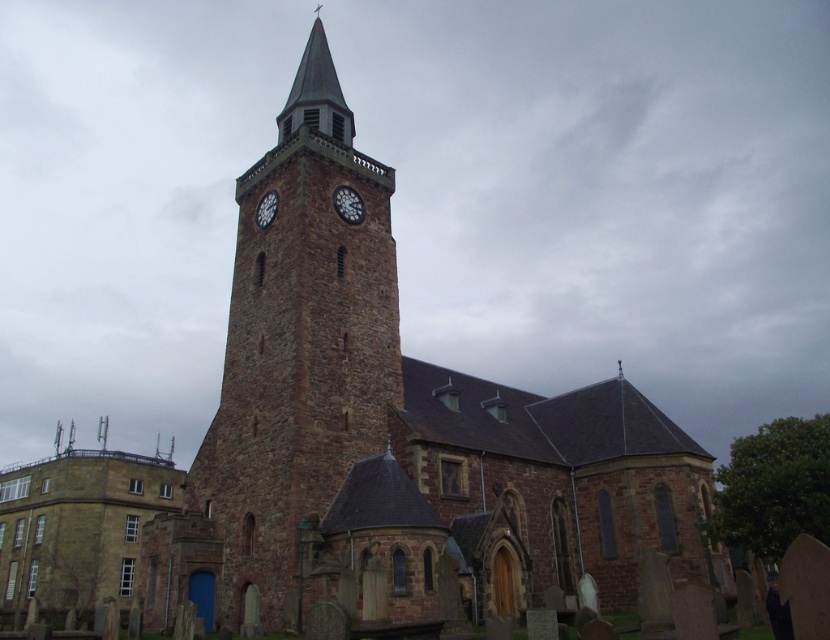
Can you confirm if dark brown wooden clock at center is wider than matte brown clock at upper center?

Correct, the width of dark brown wooden clock at center exceeds that of matte brown clock at upper center.

Between point (360, 220) and point (269, 205), which one is positioned in front?

Point (269, 205) is more forward.

The width and height of the screenshot is (830, 640). Identify the location of dark brown wooden clock at center. (348, 204).

How distant is brown stone clock tower at center from dark brown wooden clock at center?

brown stone clock tower at center and dark brown wooden clock at center are 11.91 meters apart from each other.

Consider the image. Is brown stone clock tower at center thinner than dark brown wooden clock at center?

In fact, brown stone clock tower at center might be wider than dark brown wooden clock at center.

Does point (255, 253) lie in front of point (360, 209)?

Yes, it is in front of point (360, 209).

This screenshot has width=830, height=640. I want to click on brown stone clock tower at center, so click(x=298, y=348).

Does brown stone church at center have a smaller size compared to matte brown clock at upper center?

No.

In order to click on brown stone church at center in this screenshot , I will do `click(394, 433)`.